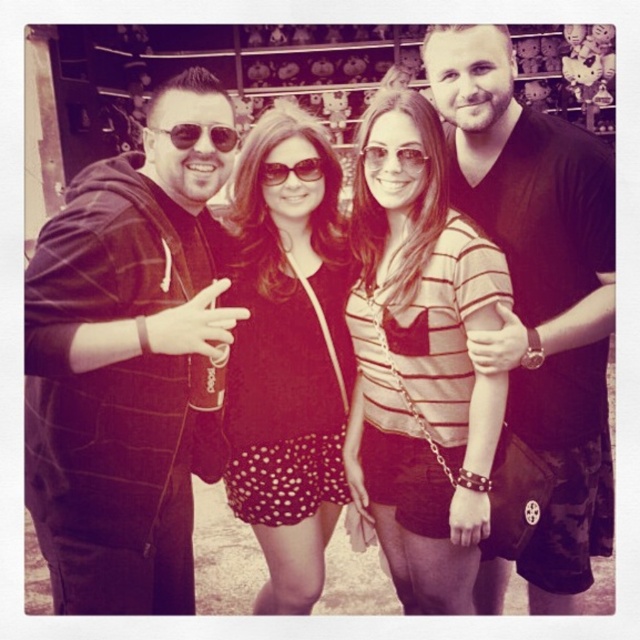
Question: Which of the following is the farthest from the observer?

Choices:
 (A) black textured hoodie at left
 (B) black matte shirt at right
 (C) sunglasses at center
 (D) sunglasses at left

Answer: (B)

Question: Which of the following is the closest to the observer?

Choices:
 (A) (259, 540)
 (B) (221, 125)
 (C) (259, 177)

Answer: (B)

Question: Among these points, which one is farthest from the camera?

Choices:
 (A) (168, 422)
 (B) (378, 170)

Answer: (B)

Question: Can you confirm if sunglasses at center is positioned below matte black sunglasses at center?

Choices:
 (A) no
 (B) yes

Answer: (B)

Question: Where is sunglasses at left located in relation to sunglasses at center in the image?

Choices:
 (A) right
 (B) left

Answer: (B)

Question: Can you confirm if sunglasses at left is positioned below matte black sunglasses at center?

Choices:
 (A) yes
 (B) no

Answer: (B)